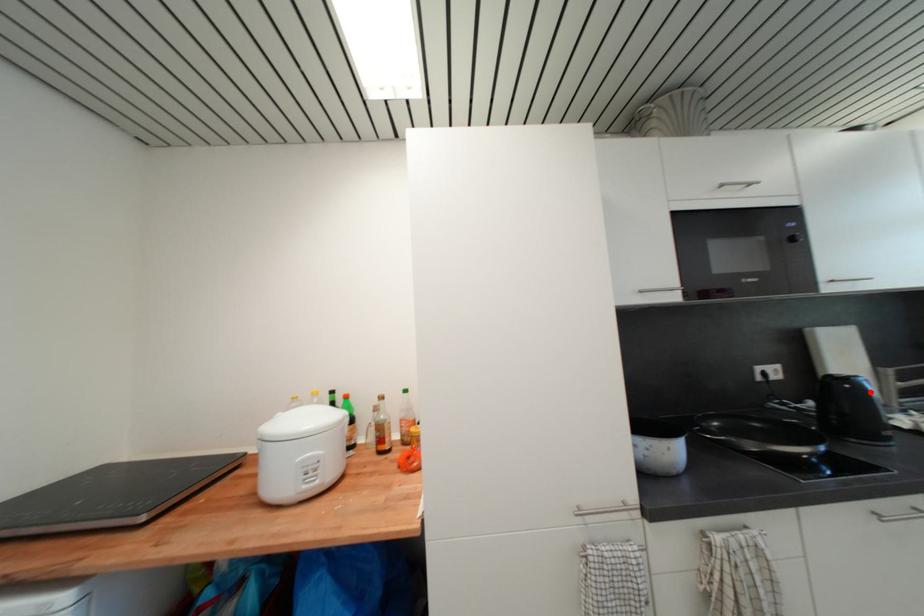
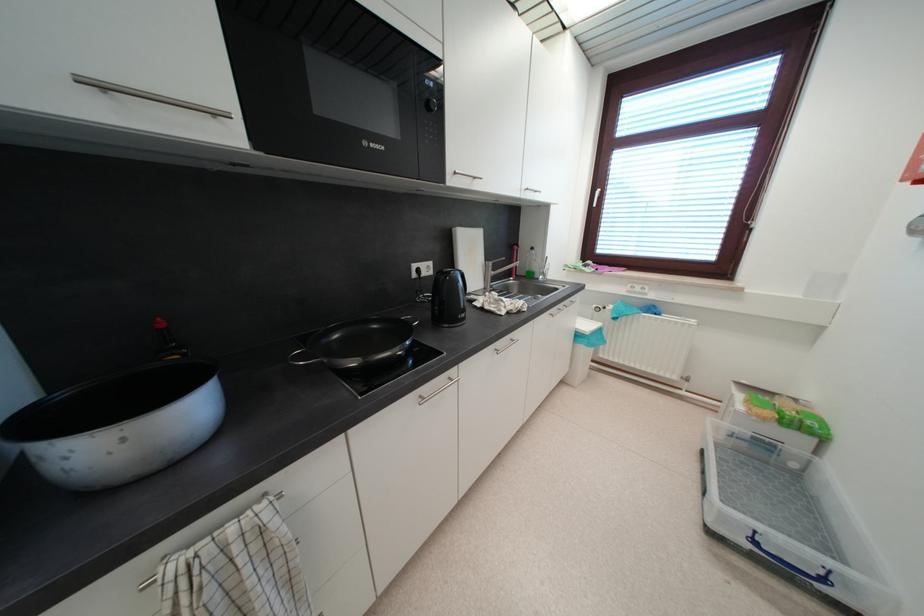
The point at the highlighted location is marked in the first image. Where is the corresponding point in the second image?

(464, 284)